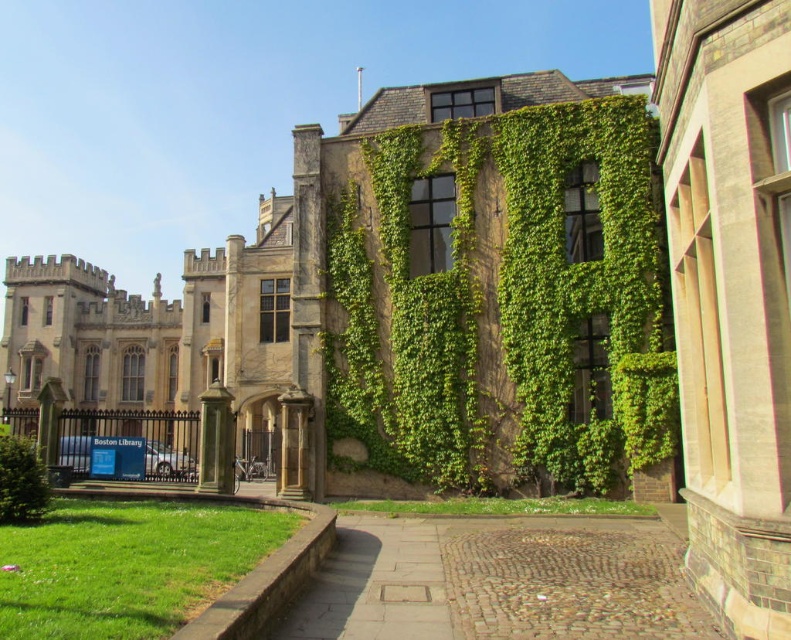
Question: Considering the relative positions of green textured ivy at center and cobblestone path at lower center in the image provided, where is green textured ivy at center located with respect to cobblestone path at lower center?

Choices:
 (A) below
 (B) above

Answer: (B)

Question: Which point is farther to the camera?

Choices:
 (A) cobblestone path at lower center
 (B) green leafy bush at lower left

Answer: (B)

Question: Is cobblestone path at lower center thinner than green leafy bush at lower left?

Choices:
 (A) no
 (B) yes

Answer: (B)

Question: Can you confirm if green textured ivy at center is positioned to the right of cobblestone path at lower center?

Choices:
 (A) no
 (B) yes

Answer: (B)

Question: Which of the following is the farthest from the observer?

Choices:
 (A) (570, 595)
 (B) (400, 172)

Answer: (B)

Question: Which object is positioned closest to the cobblestone path at lower center?

Choices:
 (A) green textured ivy at center
 (B) green leafy bush at lower left

Answer: (A)